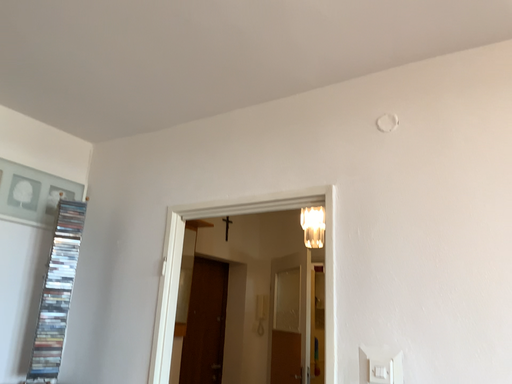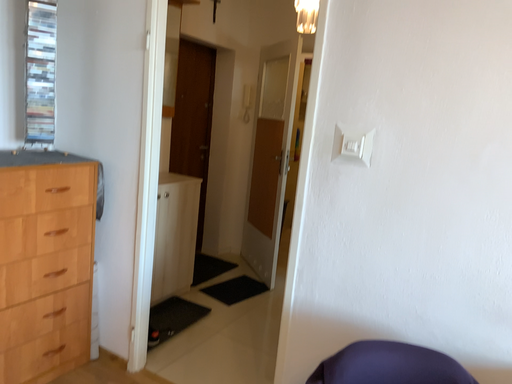
Question: How did the camera likely rotate when shooting the video?

Choices:
 (A) rotated downward
 (B) rotated upward

Answer: (A)